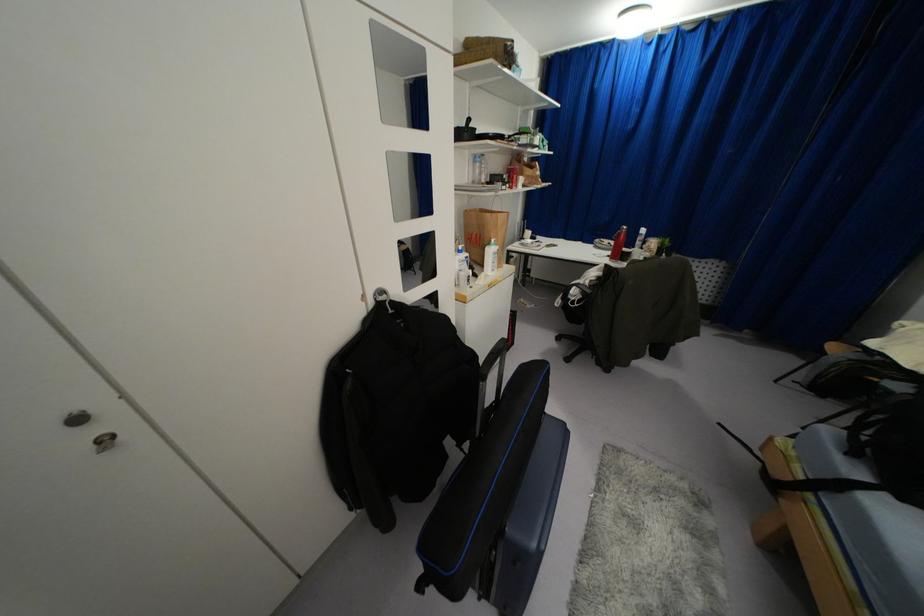
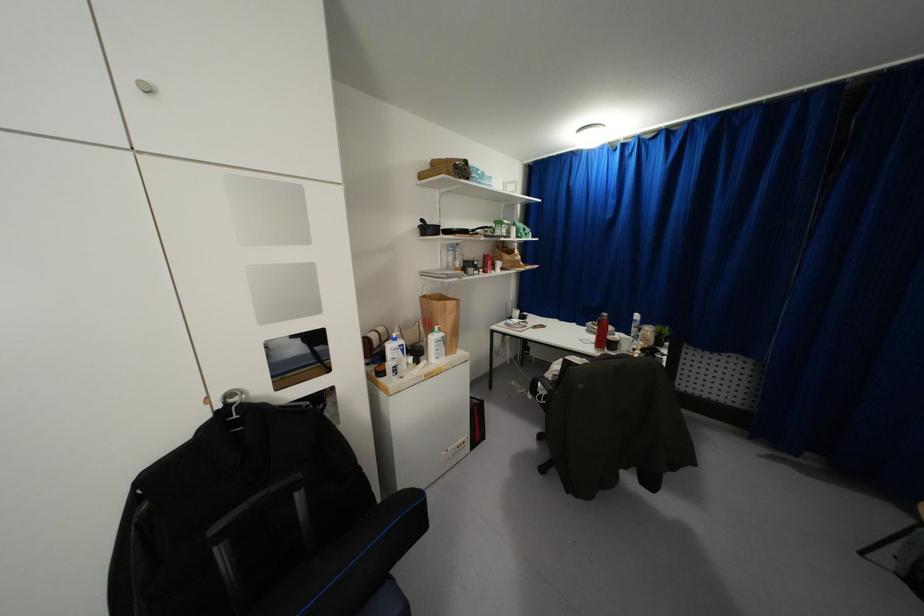
In the second image, find the point that corresponds to (x=468, y=120) in the first image.

(421, 220)